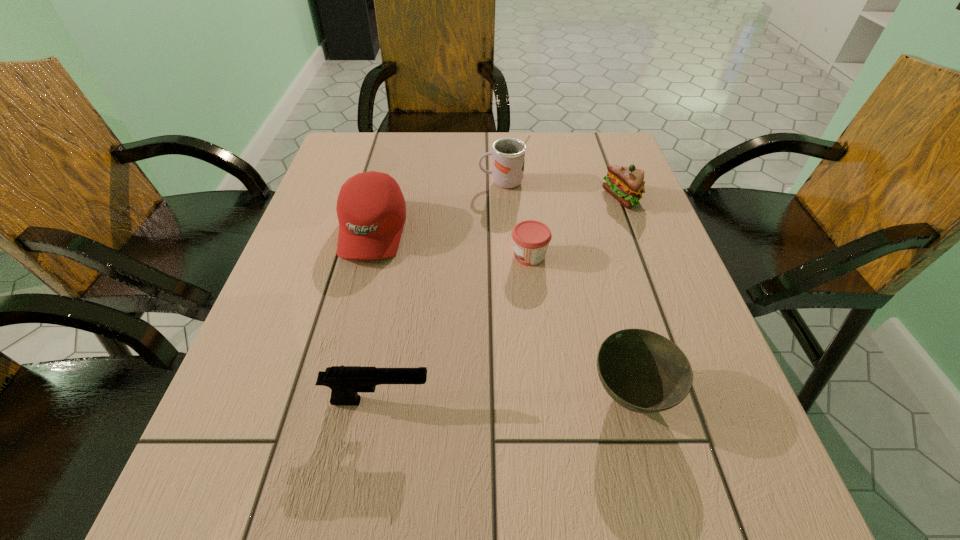
Locate an element on the screen. This screenshot has width=960, height=540. bowl present at the right edge is located at coordinates (643, 371).

Locate an element on the screen. This screenshot has height=540, width=960. free region at the far edge of the desktop is located at coordinates (441, 144).

The width and height of the screenshot is (960, 540). I want to click on free space at the near edge, so click(x=332, y=489).

The width and height of the screenshot is (960, 540). Find the location of `free space at the left edge of the desktop`. free space at the left edge of the desktop is located at coordinates (218, 430).

The image size is (960, 540). Identify the location of vacant space at the right edge of the desktop. (587, 193).

Locate an element on the screen. The width and height of the screenshot is (960, 540). free spot at the far left corner of the desktop is located at coordinates (354, 168).

Identify the location of free spot at the far right corner of the desktop. (618, 151).

Where is `vacant area that lies between the sandwich and the jam`? The image size is (960, 540). vacant area that lies between the sandwich and the jam is located at coordinates (576, 227).

The image size is (960, 540). Find the location of `vacant area between the sandwich and the shortest object`. vacant area between the sandwich and the shortest object is located at coordinates coord(576,227).

This screenshot has width=960, height=540. Identify the location of free space between the cap and the pistol. (375, 316).